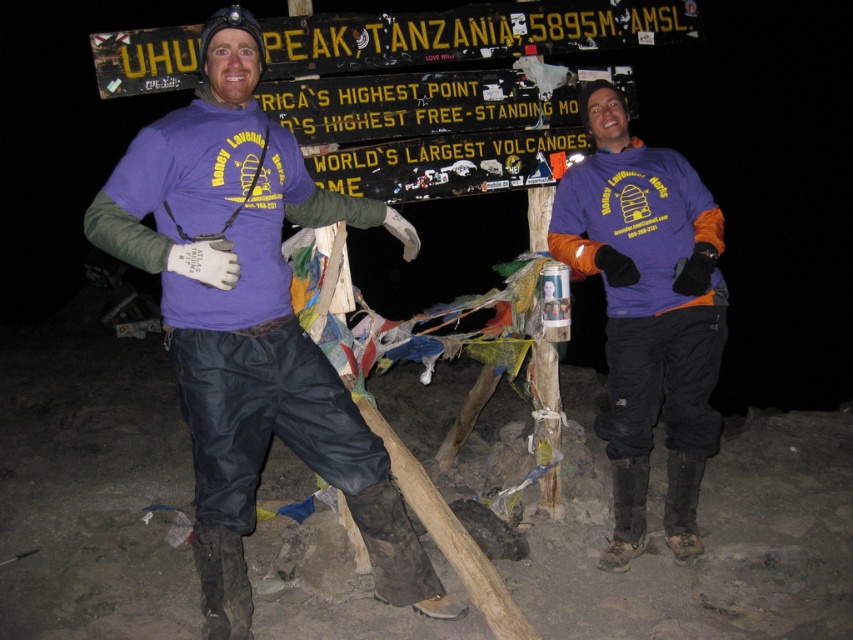
Question: Which point is closer to the camera?

Choices:
 (A) purple fabric shirt at right
 (B) purple fabric shirt at center

Answer: (B)

Question: Is purple fabric shirt at center positioned at the back of purple fabric shirt at right?

Choices:
 (A) no
 (B) yes

Answer: (A)

Question: Which point appears farthest from the camera in this image?

Choices:
 (A) (709, 348)
 (B) (216, 138)

Answer: (A)

Question: Does purple fabric shirt at center have a greater width compared to purple fabric shirt at right?

Choices:
 (A) no
 (B) yes

Answer: (B)

Question: Is purple fabric shirt at center above purple fabric shirt at right?

Choices:
 (A) no
 (B) yes

Answer: (A)